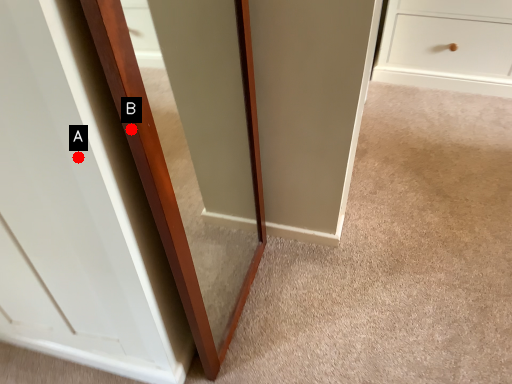
Question: Two points are circled on the image, labeled by A and B beside each circle. Which of the following is the closest to the observer?

Choices:
 (A) A is closer
 (B) B is closer

Answer: (B)